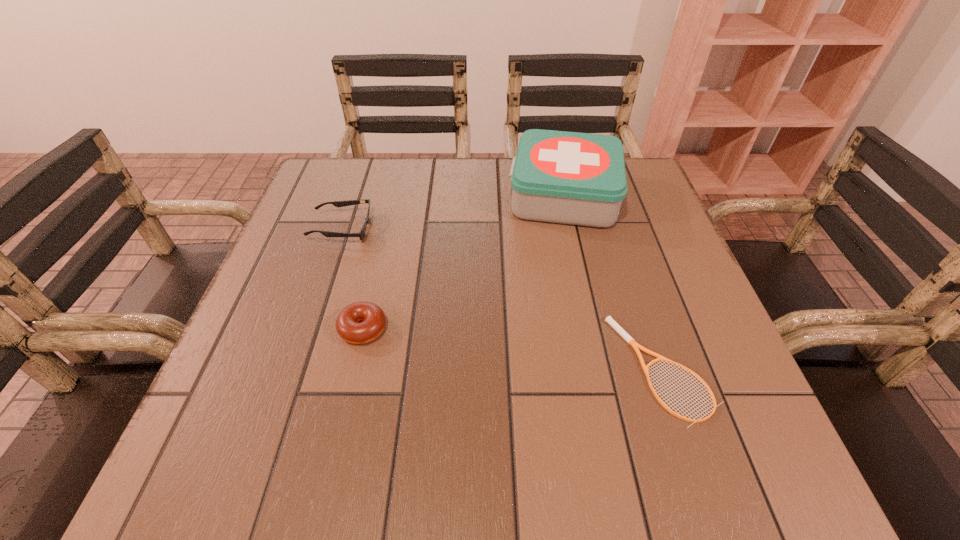
I want to click on vacant area that lies between the sunglasses and the shortest object, so click(x=502, y=299).

Where is `vacant region between the doughnut and the sunglasses`? The height and width of the screenshot is (540, 960). vacant region between the doughnut and the sunglasses is located at coordinates [x=352, y=279].

Find the location of a particular element. This screenshot has height=540, width=960. empty space that is in between the first-aid kit and the sunglasses is located at coordinates (453, 212).

Locate an element on the screen. object that is the second nearest to the sunglasses is located at coordinates (574, 178).

Locate which object ranks second in proximity to the first-aid kit. Please provide its 2D coordinates. Your answer should be formatted as a tuple, i.e. [(x, y)], where the tuple contains the x and y coordinates of a point satisfying the conditions above.

[(361, 234)]

Where is `vacant area that satisfies the following two spatial constraints: 1. on the front side of the shortest object; 2. on the left side of the first-aid kit`? This screenshot has width=960, height=540. vacant area that satisfies the following two spatial constraints: 1. on the front side of the shortest object; 2. on the left side of the first-aid kit is located at coordinates (603, 369).

I want to click on free region that satisfies the following two spatial constraints: 1. on the front-facing side of the sunglasses; 2. on the left side of the shortest object, so click(294, 369).

Locate an element on the screen. This screenshot has width=960, height=540. free spot that satisfies the following two spatial constraints: 1. on the front-facing side of the sunglasses; 2. on the back side of the shortest object is located at coordinates (294, 369).

Where is `free location that satisfies the following two spatial constraints: 1. on the front-facing side of the tennis racket; 2. on the left side of the sunglasses`? free location that satisfies the following two spatial constraints: 1. on the front-facing side of the tennis racket; 2. on the left side of the sunglasses is located at coordinates (294, 369).

Where is `free space that satisfies the following two spatial constraints: 1. on the front side of the shortest object; 2. on the right side of the first-aid kit`? This screenshot has height=540, width=960. free space that satisfies the following two spatial constraints: 1. on the front side of the shortest object; 2. on the right side of the first-aid kit is located at coordinates (603, 369).